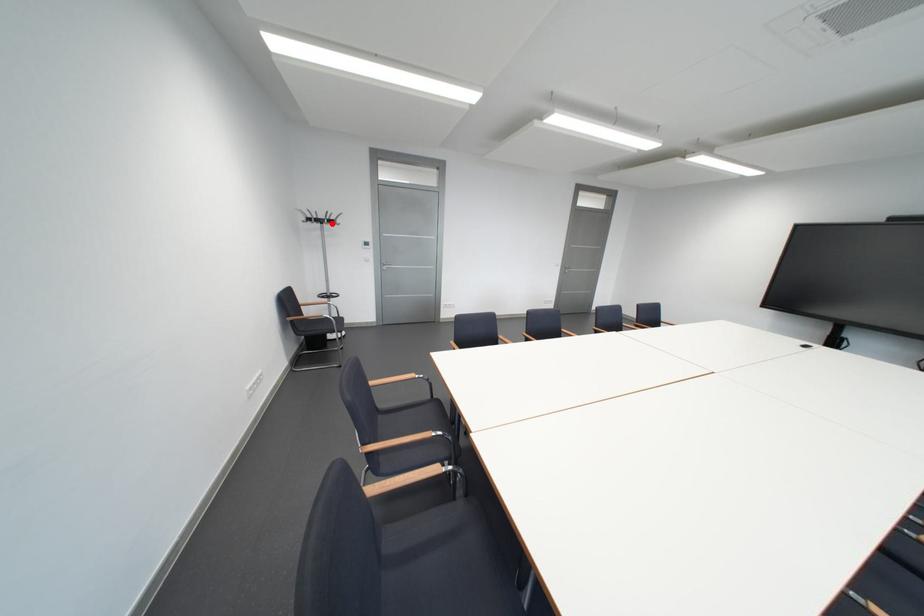
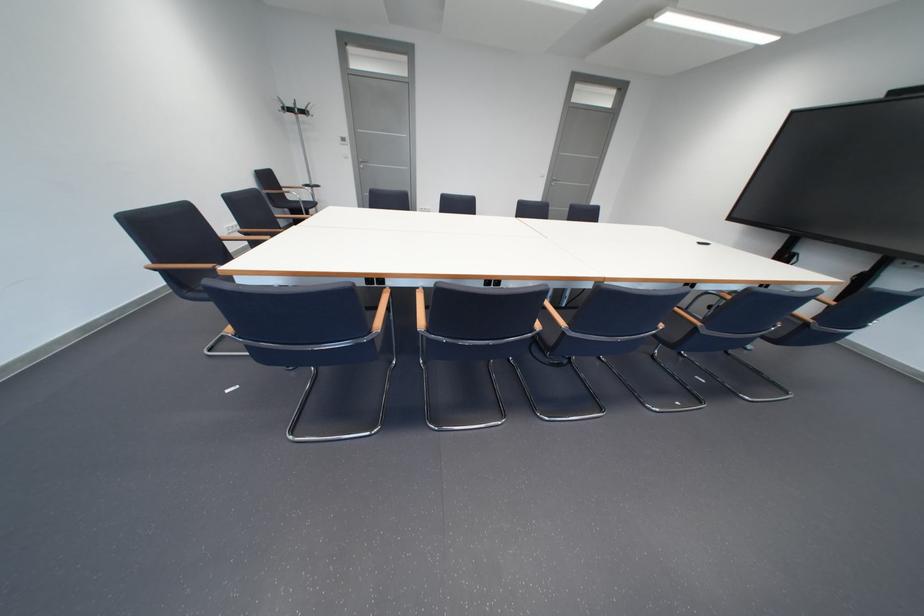
Question: A red point is marked in image1. In image2, is the corresponding 3D point closer to the camera or farther? Reply with the corresponding letter.

Choices:
 (A) The corresponding 3D point is closer.
 (B) The corresponding 3D point is farther.

Answer: (B)